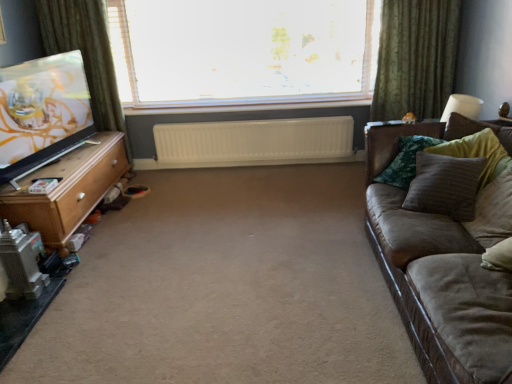
What is the approximate width of velvet green pillow at right, arranged as the first pillow when viewed from the back?

velvet green pillow at right, arranged as the first pillow when viewed from the back, is 11.61 inches in width.

This screenshot has width=512, height=384. In order to click on white plastic radiator at center in this screenshot , I will do `click(254, 142)`.

Image resolution: width=512 pixels, height=384 pixels. What do you see at coordinates (86, 54) in the screenshot?
I see `green fabric curtain at left, the first curtain in the left-to-right sequence` at bounding box center [86, 54].

Locate an element on the screen. green fabric curtain at left, the first curtain in the left-to-right sequence is located at coordinates (86, 54).

In order to click on transparent glass window at center in this screenshot , I will do `click(243, 51)`.

Locate an element on the screen. velvet green pillow at right, arranged as the 4th pillow when viewed from the front is located at coordinates (405, 161).

Is matte black tv at left spatially inside velvet green pillow at right, arranged as the 4th pillow when viewed from the front, or outside of it?

matte black tv at left is not enclosed by velvet green pillow at right, arranged as the 4th pillow when viewed from the front.

Is matte black tv at left to the right of velvet green pillow at right, arranged as the 4th pillow when viewed from the front, from the viewer's perspective?

Incorrect, matte black tv at left is not on the right side of velvet green pillow at right, arranged as the 4th pillow when viewed from the front.

How many degrees apart are the facing directions of matte black tv at left and velvet green pillow at right, arranged as the 4th pillow when viewed from the front?

The angular difference between matte black tv at left and velvet green pillow at right, arranged as the 4th pillow when viewed from the front, is 75.9 degrees.

Which is more distant, (87, 137) or (405, 169)?

The point (87, 137) is farther from the camera.

In terms of width, does suede brown couch at right look wider or thinner when compared to matte black tv at left?

Considering their sizes, suede brown couch at right looks broader than matte black tv at left.

Which object is closer to the camera taking this photo, suede brown couch at right or matte black tv at left?

Positioned in front is suede brown couch at right.

Does point (472, 260) lie behind point (22, 112)?

No.

Would you say suede brown couch at right is outside brown textured pillow at right, arranged as the 1th pillow when viewed from the front?

Yes.

Which is behind, suede brown couch at right or brown textured pillow at right, the fourth pillow viewed from the back?

brown textured pillow at right, the fourth pillow viewed from the back, is further from the camera.

Is brown textured pillow at right, the fourth pillow viewed from the back, at the back of suede brown couch at right?

Result: Yes, brown textured pillow at right, the fourth pillow viewed from the back, is at the back of suede brown couch at right.

Relative to brown textured pillow at right, which is counted as the 3th pillow, starting from the back, is beige carpet at center in front or behind?

In the image, beige carpet at center appears in front of brown textured pillow at right, which is counted as the 3th pillow, starting from the back.

From the picture: Measure the distance between beige carpet at center and brown textured pillow at right, which is counted as the 3th pillow, starting from the back.

3.32 feet.

Considering the relative sizes of beige carpet at center and brown textured pillow at right, which is counted as the 3th pillow, starting from the back, in the image provided, is beige carpet at center smaller than brown textured pillow at right, which is counted as the 3th pillow, starting from the back,?

No, beige carpet at center is not smaller than brown textured pillow at right, which is counted as the 3th pillow, starting from the back.

Can you confirm if beige carpet at center is positioned to the right of light brown wood tv stand at left?

Correct, you'll find beige carpet at center to the right of light brown wood tv stand at left.

In the scene shown: Which object is closer to the camera taking this photo, beige carpet at center or light brown wood tv stand at left?

beige carpet at center is in front.

Is point (148, 179) more distant than point (67, 159)?

Yes, point (148, 179) is farther from viewer.

From the image's perspective, relative to light brown wood tv stand at left, is beige carpet at center above or below?

From the image's perspective, beige carpet at center appears below light brown wood tv stand at left.

Between light brown wood tv stand at left and white plastic radiator at center, which one appears on the left side from the viewer's perspective?

light brown wood tv stand at left is more to the left.

Could you tell me if light brown wood tv stand at left is turned towards white plastic radiator at center?

Yes.

Based on the photo, does light brown wood tv stand at left come behind white plastic radiator at center?

No, light brown wood tv stand at left is closer to the camera.

Based on the photo, looking at their sizes, would you say light brown wood tv stand at left is wider or thinner than white plastic radiator at center?

Considering their sizes, light brown wood tv stand at left looks broader than white plastic radiator at center.

Who is bigger, suede brown couch at right or beige carpet at center?

With larger size is suede brown couch at right.

From a real-world perspective, is suede brown couch at right positioned over beige carpet at center based on gravity?

Correct, in the physical world, suede brown couch at right is higher than beige carpet at center.

Is point (445, 242) closer to viewer compared to point (198, 340)?

Yes, it is.

Is suede brown couch at right closer to camera compared to beige carpet at center?

Yes, it is in front of beige carpet at center.

Locate an element on the screen. television lying above the velvet green pillow at right, arranged as the first pillow when viewed from the back (from the image's perspective) is located at coordinates (42, 112).

Locate an element on the screen. This screenshot has width=512, height=384. television located on the left of suede brown couch at right is located at coordinates (42, 112).

From the image, which object appears to be farther from matte black tv at left, beige carpet at center or brown textured pillow at right, arranged as the 1th pillow when viewed from the front?

brown textured pillow at right, arranged as the 1th pillow when viewed from the front, lies further to matte black tv at left than the other object.

Considering their positions, is transparent glass window at center positioned further to beige carpet at center than green fabric curtain at left, which is counted as the second curtain, starting from the right?

transparent glass window at center lies further to beige carpet at center than the other object.

From the picture: Based on their spatial positions, is brown textured pillow at right, acting as the second pillow starting from the front, or white plastic radiator at center further from green fabric curtain at left, the first curtain in the left-to-right sequence?

brown textured pillow at right, acting as the second pillow starting from the front, is positioned further to the anchor green fabric curtain at left, the first curtain in the left-to-right sequence.

When comparing their distances from transparent glass window at center, does suede brown couch at right or green fabric curtain at left, the first curtain in the left-to-right sequence, seem further?

Among the two, suede brown couch at right is located further to transparent glass window at center.

Estimate the real-world distances between objects in this image. Which object is further from brown textured pillow at right, the fourth pillow viewed from the back, green textured curtain at upper right, which is the second curtain in left-to-right order, or beige carpet at center?

green textured curtain at upper right, which is the second curtain in left-to-right order.

Considering their positions, is green fabric curtain at left, the first curtain in the left-to-right sequence, positioned further to light brown wood tv stand at left than suede brown couch at right?

suede brown couch at right.

Based on their spatial positions, is light brown wood tv stand at left or matte black tv at left further from transparent glass window at center?

light brown wood tv stand at left lies further to transparent glass window at center than the other object.

Which object lies nearer to the anchor point transparent glass window at center, white plastic radiator at center or green fabric curtain at left, the first curtain in the left-to-right sequence?

Based on the image, white plastic radiator at center appears to be nearer to transparent glass window at center.

What are the coordinates of `television between beige carpet at center and green fabric curtain at left, the first curtain in the left-to-right sequence, from front to back` in the screenshot? It's located at (42, 112).

The height and width of the screenshot is (384, 512). Find the location of `table between green fabric curtain at left, the first curtain in the left-to-right sequence, and green textured curtain at upper right, which is the second curtain in left-to-right order`. table between green fabric curtain at left, the first curtain in the left-to-right sequence, and green textured curtain at upper right, which is the second curtain in left-to-right order is located at coordinates (67, 190).

Identify the location of table positioned between matte black tv at left and white plastic radiator at center from near to far. (67, 190).

You are a GUI agent. You are given a task and a screenshot of the screen. Output one action in this format:
    pyautogui.click(x=<x>, y=<y>)
    Task: Click on the plain between matte black tv at left and suede brown couch at right
    
    Given the screenshot: What is the action you would take?
    pyautogui.click(x=226, y=287)